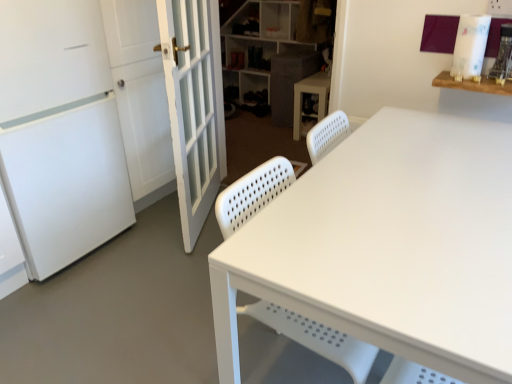
Question: From the image's perspective, is textured gray cabinet at center beneath white plastic shelf at upper center?

Choices:
 (A) no
 (B) yes

Answer: (B)

Question: Can you confirm if textured gray cabinet at center is taller than white plastic shelf at upper center?

Choices:
 (A) yes
 (B) no

Answer: (B)

Question: Is textured gray cabinet at center in contact with white plastic shelf at upper center?

Choices:
 (A) no
 (B) yes

Answer: (A)

Question: Can you confirm if textured gray cabinet at center is shorter than white plastic shelf at upper center?

Choices:
 (A) no
 (B) yes

Answer: (B)

Question: From a real-world perspective, is textured gray cabinet at center beneath white plastic shelf at upper center?

Choices:
 (A) yes
 (B) no

Answer: (A)

Question: Based on their sizes in the image, would you say textured gray cabinet at center is bigger or smaller than wooden shelf at upper right?

Choices:
 (A) small
 (B) big

Answer: (B)

Question: Visually, is textured gray cabinet at center positioned to the left or to the right of wooden shelf at upper right?

Choices:
 (A) right
 (B) left

Answer: (B)

Question: In terms of width, does textured gray cabinet at center look wider or thinner when compared to wooden shelf at upper right?

Choices:
 (A) wide
 (B) thin

Answer: (A)

Question: Relative to wooden shelf at upper right, is textured gray cabinet at center in front or behind?

Choices:
 (A) front
 (B) behind

Answer: (B)

Question: Is white glass door at left bigger or smaller than white matte screen door at left?

Choices:
 (A) small
 (B) big

Answer: (A)

Question: Is white glass door at left inside the boundaries of white matte screen door at left, or outside?

Choices:
 (A) outside
 (B) inside

Answer: (A)

Question: Looking at their shapes, would you say white glass door at left is wider or thinner than white matte screen door at left?

Choices:
 (A) wide
 (B) thin

Answer: (B)

Question: Is white glass door at left in front of or behind white matte screen door at left in the image?

Choices:
 (A) front
 (B) behind

Answer: (B)

Question: From a real-world perspective, is white perforated plastic swivel chair at center physically located above or below white glass door at left?

Choices:
 (A) below
 (B) above

Answer: (A)

Question: From the image's perspective, is white perforated plastic swivel chair at center positioned above or below white glass door at left?

Choices:
 (A) below
 (B) above

Answer: (A)